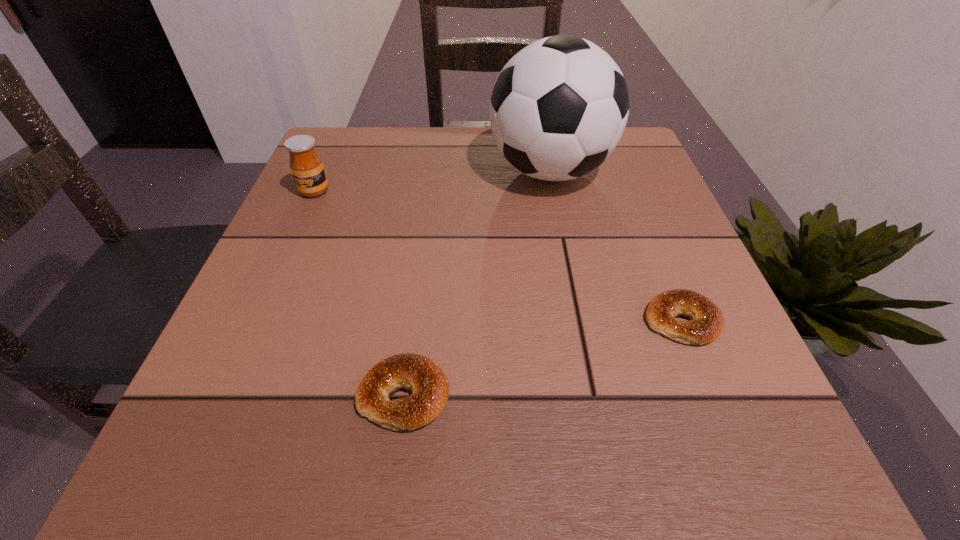
This screenshot has height=540, width=960. I want to click on vacant space located on the left of the farther bagel, so click(x=414, y=321).

The width and height of the screenshot is (960, 540). In order to click on soccer ball that is at the far edge in this screenshot , I will do `click(558, 109)`.

Where is `honey that is positioned at the far edge`? This screenshot has width=960, height=540. honey that is positioned at the far edge is located at coordinates (306, 165).

Locate an element on the screen. The image size is (960, 540). object located in the near edge section of the desktop is located at coordinates (430, 387).

Where is `object situated at the left edge`? object situated at the left edge is located at coordinates (306, 165).

The width and height of the screenshot is (960, 540). Identify the location of soccer ball that is positioned at the right edge. (558, 109).

Identify the location of bagel that is positioned at the right edge. pyautogui.click(x=707, y=322).

Locate an element on the screen. This screenshot has width=960, height=540. object at the far left corner is located at coordinates (306, 165).

Locate an element on the screen. This screenshot has height=540, width=960. object that is positioned at the far right corner is located at coordinates (558, 109).

This screenshot has width=960, height=540. Identify the location of free space at the far edge of the desktop. (410, 172).